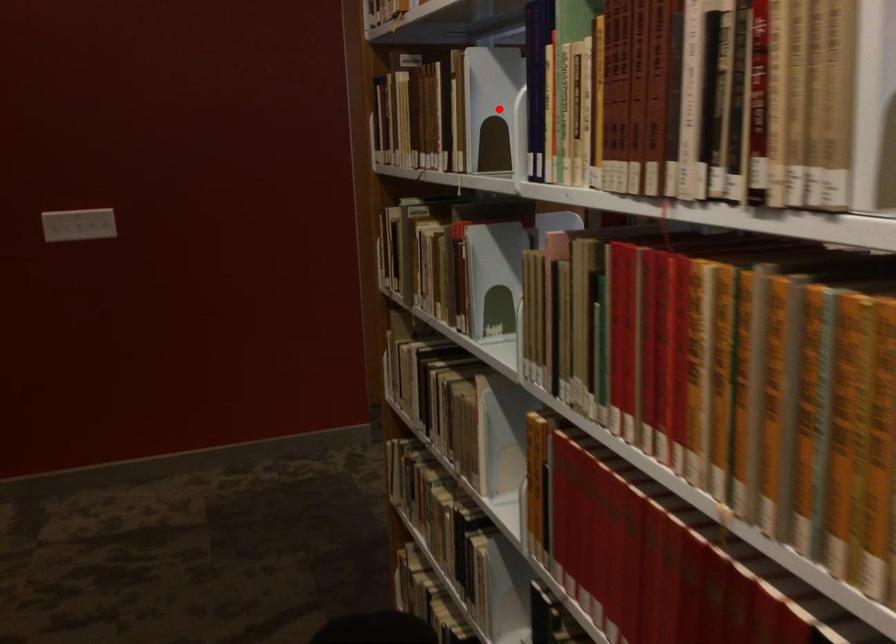
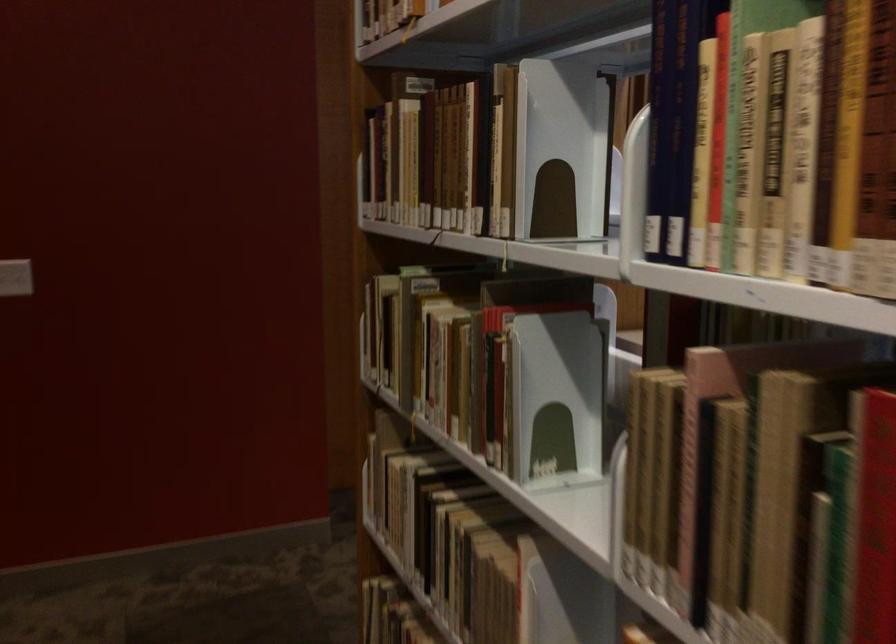
The point at the highlighted location is marked in the first image. Where is the corresponding point in the second image?

(561, 149)